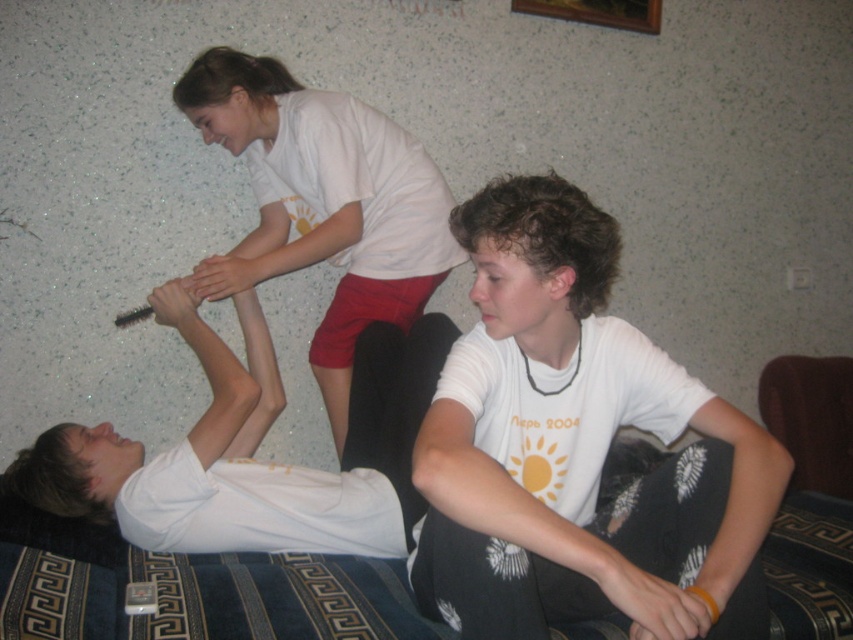
You are a photographer setting up a tripod in this room. You need to position it so that both the dark blue fabric couch at lower center and the white matte shirt at upper center are visible in the frame. Considering their heights, which object should be placed closer to the camera to ensure both are fully visible?

The dark blue fabric couch at lower center is shorter than the white matte shirt at upper center. To ensure both are fully visible, the shorter object, the dark blue fabric couch at lower center, should be placed closer to the camera.

You are designing a layout for a magazine spread and need to place a rectangular text box over the image. The text box must be placed where the white matte shirt at center and dark blue fabric couch at lower center are located. Given their relative sizes, which object should the text box be placed over to ensure the text is more prominent?

The text box should be placed over the dark blue fabric couch at lower center because it is wider than the white matte shirt at center, allowing for a larger text area.

You are designing a new outfit and need to know the relative sizes of the clothing items in the scene. Which object is bigger, the white matte shirt at center or the dark blue fabric couch at lower center?

The white matte shirt at center is larger in size than the dark blue fabric couch at lower center.